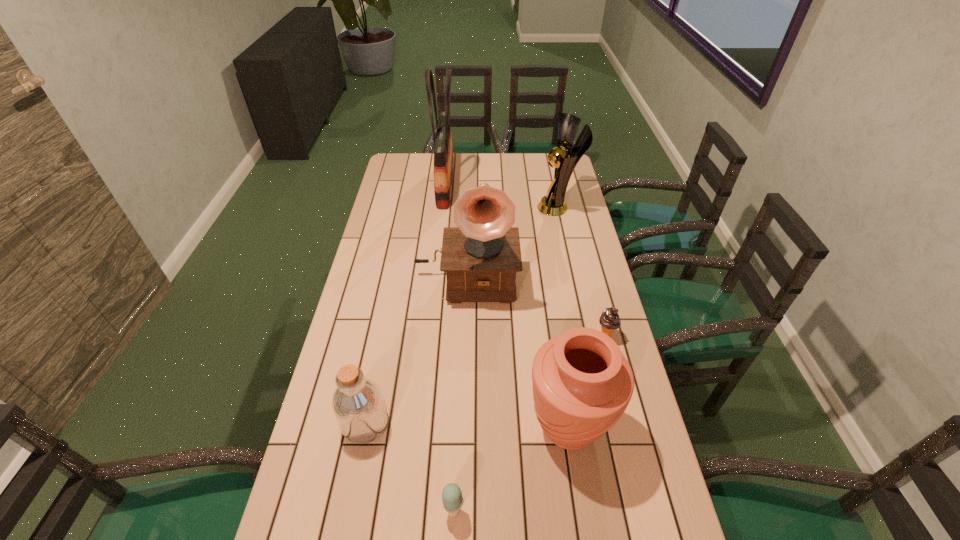
Find the location of a particular element. The width and height of the screenshot is (960, 540). object situated at the left edge is located at coordinates [358, 405].

Where is `award that is at the right edge`? This screenshot has height=540, width=960. award that is at the right edge is located at coordinates tap(553, 204).

The width and height of the screenshot is (960, 540). What are the coordinates of `vase at the right edge` in the screenshot? It's located at (582, 384).

Identify the location of icecream that is positioned at the right edge. (609, 320).

Find the location of a particular element. The width and height of the screenshot is (960, 540). vacant space at the far edge is located at coordinates (472, 156).

This screenshot has height=540, width=960. Find the location of `vacant space at the left edge of the desktop`. vacant space at the left edge of the desktop is located at coordinates (405, 203).

Where is `free region at the right edge of the desktop`? free region at the right edge of the desktop is located at coordinates (618, 440).

In the image, there is a desktop. What are the coordinates of `vacant space at the far left corner` in the screenshot? It's located at (412, 165).

This screenshot has height=540, width=960. In order to click on vacant point located between the award and the nearer ice cream in this screenshot , I will do `click(506, 359)`.

Locate an element on the screen. The width and height of the screenshot is (960, 540). blank region between the leftmost object and the record player is located at coordinates (416, 350).